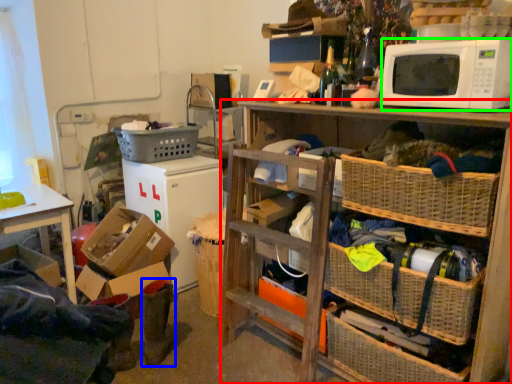
Question: Based on their relative distances, which object is nearer to shelf (highlighted by a red box)? Choose from boots (highlighted by a blue box) and microwave oven (highlighted by a green box).

Choices:
 (A) boots
 (B) microwave oven

Answer: (B)